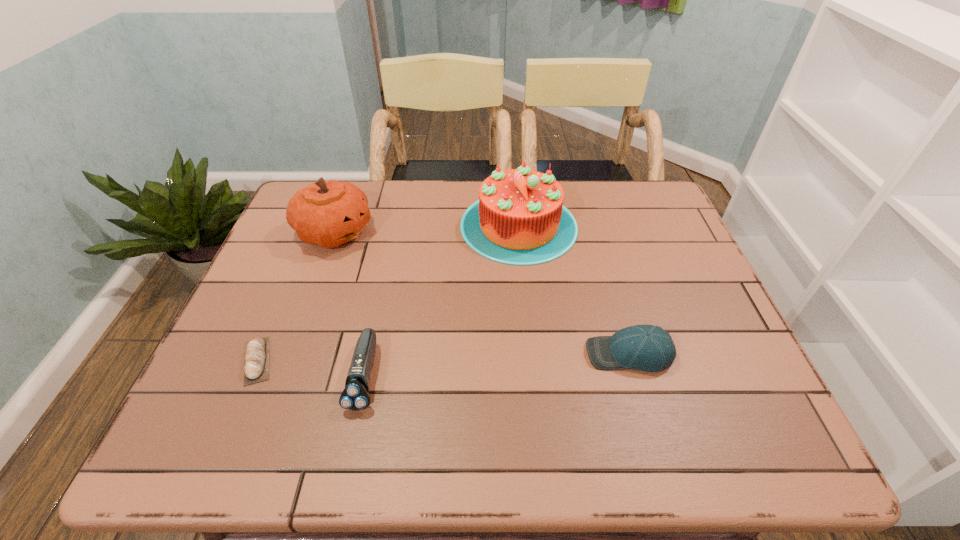
What are the coordinates of `vacant space at the far right corner of the desktop` in the screenshot? It's located at (660, 196).

This screenshot has width=960, height=540. Identify the location of blank area at the near right corner. (701, 447).

Where is `free space between the electric shaver and the pita bread`? free space between the electric shaver and the pita bread is located at coordinates (311, 368).

Identify the location of free spot between the electric shaver and the baseball cap. (497, 364).

Find the location of a particular element. The width and height of the screenshot is (960, 540). free space between the cake and the baseball cap is located at coordinates (574, 289).

At what (x,y) coordinates should I click in order to perform the action: click on empty space that is in between the pita bread and the third object from right to left. Please return your answer as a coordinate pair (x, y). This screenshot has height=540, width=960. Looking at the image, I should click on (311, 368).

At what (x,y) coordinates should I click in order to perform the action: click on free point between the electric shaver and the pumpkin. Please return your answer as a coordinate pair (x, y). The height and width of the screenshot is (540, 960). Looking at the image, I should click on (349, 303).

Identify the location of unoccupied area between the pita bread and the baseball cap. The image size is (960, 540). (444, 357).

Image resolution: width=960 pixels, height=540 pixels. I want to click on empty space that is in between the baseball cap and the pumpkin, so click(482, 293).

Find the location of a particular element. This screenshot has width=960, height=540. free spot between the baseball cap and the cake is located at coordinates (574, 289).